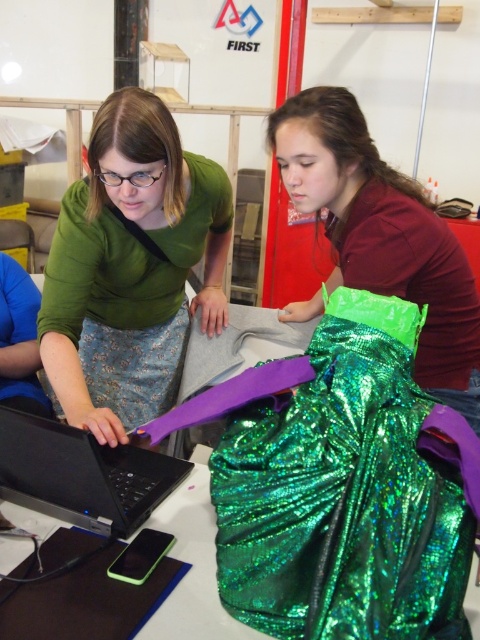
You are standing in front of the table where the laptop and the shiny green fabric item are placed. There is a point at coordinates point (x=399, y=337) that you need to reach. Can you estimate whether this point is within arm s reach?

The point at coordinates point (x=399, y=337) is 32.72 inches away from the viewer, which is approximately 2.73 feet. Since the average human arm length is about 2.5 feet, this point is slightly out of arm s reach.

You are a photographer setting up for a photoshoot. You have a green sparkly skirt at center and a black matte laptop at center. The client wants the skirt to be the main focus, but the laptop needs to be visible in the background. Based on their positions, which object should you position closer to the camera to ensure the skirt is the main focus?

The green sparkly skirt at center is to the right of the black matte laptop at center. To make the skirt the main focus, position it closer to the camera since it is already placed to the right of the laptop, allowing the laptop to remain visible in the background.

You are a tailor who needs to place a green sequined skirt at center onto a mannequin. The green sequined fabric at center is currently lying on the table. Can you reach the fabric from your current position near the skirt without moving the skirt?

The green sequined fabric at center and green sequined skirt at center are 18.73 inches apart. Since the distance is manageable, you can easily reach the fabric from near the skirt without moving it.